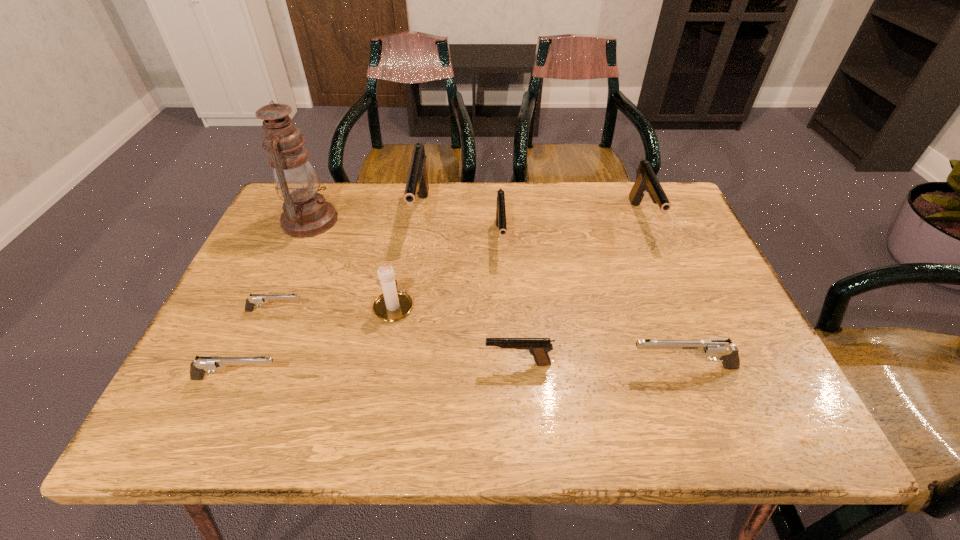
This screenshot has height=540, width=960. Find the location of `black pistol that is the third closest to the white candle holder`. black pistol that is the third closest to the white candle holder is located at coordinates (500, 207).

Point out which black pistol is positioned as the second nearest to the leftmost black pistol. Please provide its 2D coordinates. Your answer should be formatted as a tuple, i.e. [(x, y)], where the tuple contains the x and y coordinates of a point satisfying the conditions above.

[(538, 347)]

Identify which silver pistol is the nearest to the tallest object. Please provide its 2D coordinates. Your answer should be formatted as a tuple, i.e. [(x, y)], where the tuple contains the x and y coordinates of a point satisfying the conditions above.

[(251, 301)]

I want to click on silver pistol that is the second closest to the shortest pistol, so click(721, 347).